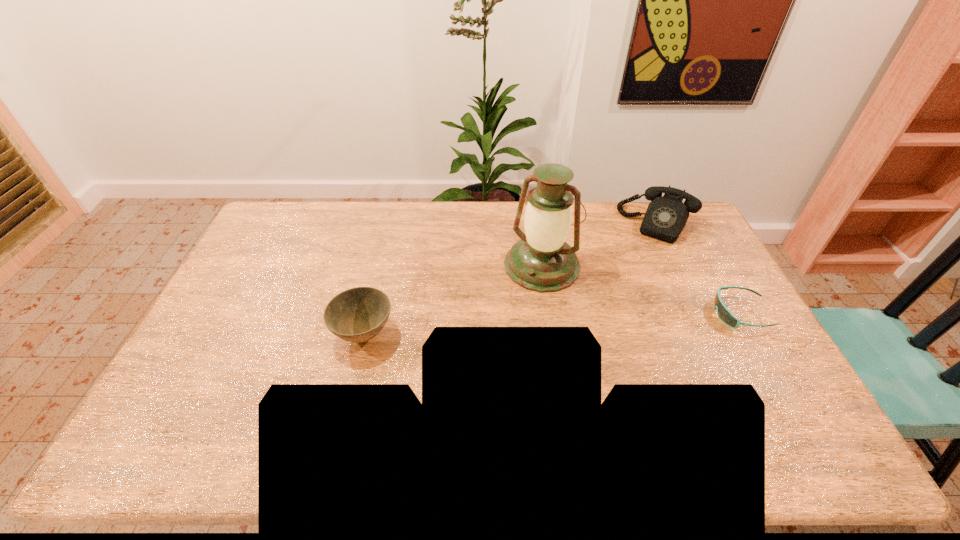
You are a GUI agent. You are given a task and a screenshot of the screen. Output one action in this format:
    pyautogui.click(x=<x>, y=<y>)
    Task: Click on the free space on the desktop that is between the leftmost object and the shortest object and is positioned on the dial of the telephone
    This screenshot has width=960, height=540.
    Given the screenshot: What is the action you would take?
    pyautogui.click(x=609, y=321)

The width and height of the screenshot is (960, 540). I want to click on free space on the desktop that is between the leftmost object and the shortest object and is positioned with the light compartment facing forward on the tallest object, so click(500, 327).